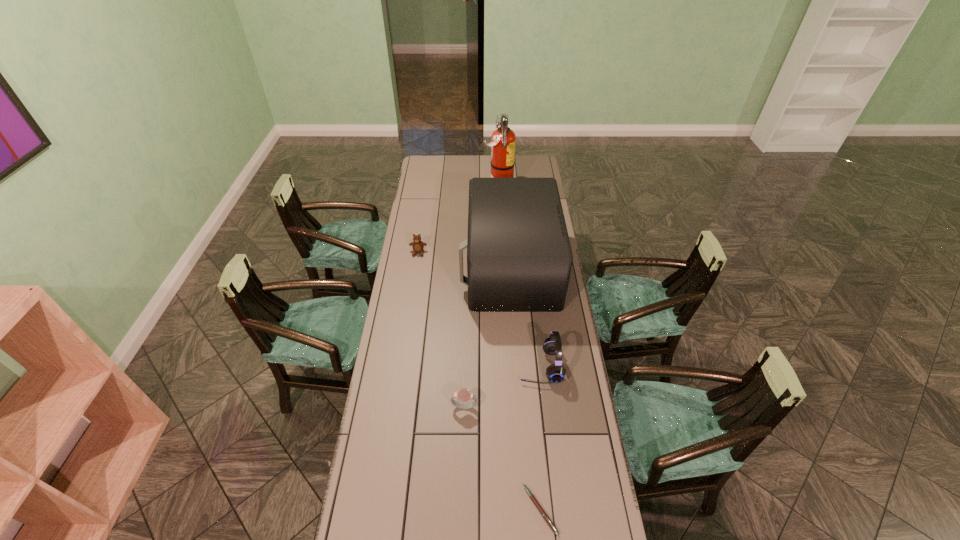
What are the coordinates of `the farthest object` in the screenshot? It's located at (502, 144).

Find the location of `the tallest object`. the tallest object is located at coordinates (502, 144).

Locate an element on the screen. The image size is (960, 540). microwave oven is located at coordinates (519, 258).

At what (x,y) coordinates should I click in order to perform the action: click on headset. Please return your answer as a coordinate pair (x, y). Image resolution: width=960 pixels, height=540 pixels. Looking at the image, I should click on (555, 373).

At what (x,y) coordinates should I click in order to perform the action: click on the third tallest object. Please return your answer as a coordinate pair (x, y). Image resolution: width=960 pixels, height=540 pixels. Looking at the image, I should click on (555, 373).

Find the location of a particular element. This screenshot has height=540, width=960. teddy bear is located at coordinates (418, 246).

In order to click on the leftmost object in this screenshot , I will do `click(418, 246)`.

You are a GUI agent. You are given a task and a screenshot of the screen. Output one action in this format:
    pyautogui.click(x=<x>, y=<y>)
    Task: Click on the watch
    This screenshot has width=960, height=540.
    Given the screenshot: What is the action you would take?
    pyautogui.click(x=463, y=395)

Where is `the fifth tallest object`? The image size is (960, 540). the fifth tallest object is located at coordinates (463, 395).

The height and width of the screenshot is (540, 960). Find the location of `the shortest object`. the shortest object is located at coordinates (544, 514).